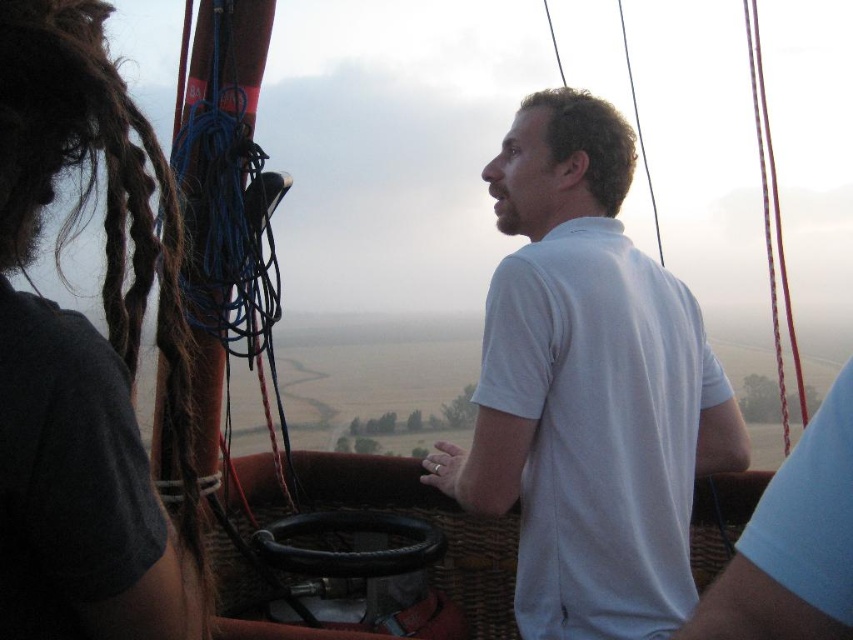
You are a photographer in the hot air balloon basket. You want to take a photo of the white matte shirt at center and dark brown dreadlocks at left. The camera you have can focus on subjects within a 3 feet range. Can both subjects be in focus at the same time?

The white matte shirt at center is 3.95 feet away from dark brown dreadlocks at left. Since the camera can only focus within 3 feet, the distance between them exceeds the focus range. Therefore, both subjects cannot be in focus simultaneously.

You are standing at the point marked as point (677, 346) in the hot air balloon basket. You need to reach a control lever located at the opposite side of the basket. The basket is 4.8 meters wide. Can you safely walk from your current position to the control lever without crossing the center of the basket?

The distance between you and the control lever is 2.40 meters, which is exactly half of the basket width of 4.8 meters. Since the basket is 4.8 meters wide, the center is at 2.4 meters from any side. Walking from point (677, 346) to the control lever would require crossing the center, so it is not safe to walk directly without crossing the center.

You are a photographer planning to take a portrait of the people in the hot air balloon basket. You want to ensure that both the white matte shirt at center and the dark brown dreadlocks at left are clearly visible in the frame. Based on their widths, which subject should you position closer to the camera to maintain clarity?

The white matte shirt at center has a greater width than the dark brown dreadlocks at left. To maintain clarity for both subjects, position the darker brown dreadlocks at left closer to the camera since they are narrower and require less space in the frame.